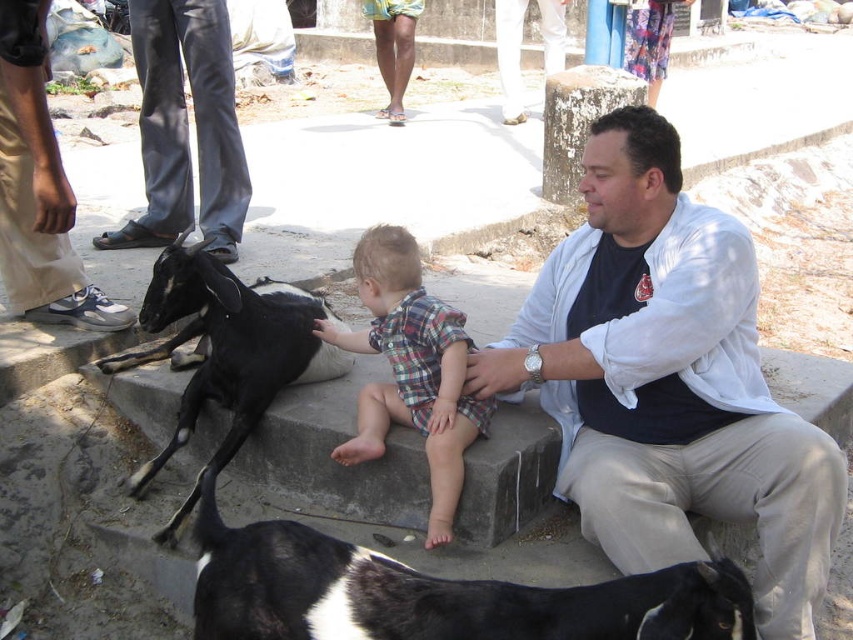
You are a visitor at a farm and see the black and white fur at lower center and the black glossy goat at center. Which object is shorter?

A: The black and white fur at lower center is shorter than the black glossy goat at center.

You are a delivery robot with a 1 meter wide package. You need to move from the right side of the scene to the left side. There is a black leather pants at left and a matte black goat at left in your path. Can you pass between them without moving the objects?

The distance between the black leather pants at left and the matte black goat at left is 1.34 meters. Since your package is 1 meter wide, you can pass between them as the space is wider than the package.

You are standing in the outdoor scene where a man and child are with goats. You see two points marked in the image. Which point is closer to you, point at coordinates (x=135, y=221) or point at coordinates (x=41, y=152)?

Point at coordinates (x=41, y=152) is closer to you because it is less further to the viewer than point at coordinates (x=135, y=221).